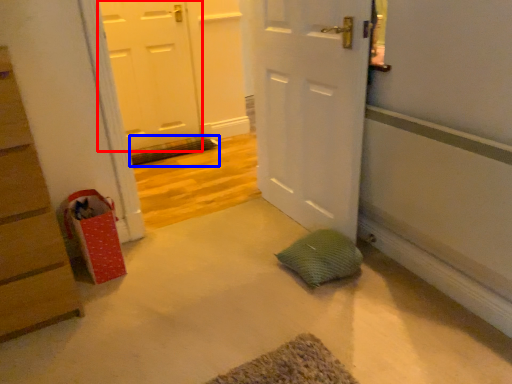
Question: Which point is further to the camera, door (highlighted by a red box) or bath mat (highlighted by a blue box)?

Choices:
 (A) door
 (B) bath mat

Answer: (B)